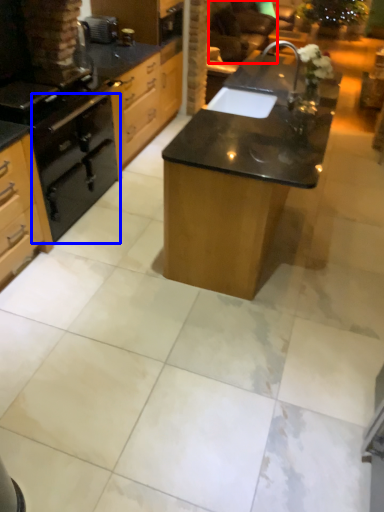
Question: Which object appears closest to the camera in this image, armchair (highlighted by a red box) or oven (highlighted by a blue box)?

Choices:
 (A) armchair
 (B) oven

Answer: (B)